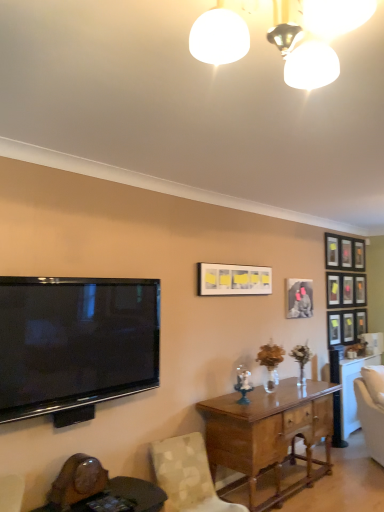
Question: Relative to white glossy light fixture at upper center, is wooden round table at lower left in front or behind?

Choices:
 (A) front
 (B) behind

Answer: (B)

Question: From the image's perspective, is wooden round table at lower left above or below white glossy light fixture at upper center?

Choices:
 (A) above
 (B) below

Answer: (B)

Question: Estimate the real-world distances between objects in this image. Which object is farther from the wooden round table at lower left?

Choices:
 (A) flat screen tv at left
 (B) matte white picture frame at center, the 1th picture frame viewed from the front
 (C) metallic silver picture frame at upper right, which is counted as the sixth picture frame, starting from the front
 (D) matte black picture frame at upper right, which is counted as the 3th picture frame, starting from the back
 (E) light brown wood desk at center

Answer: (C)

Question: Estimate the real-world distances between objects in this image. Which object is farther from the metallic silver picture frame at upper right, which ranks as the 6th picture frame in left-to-right order?

Choices:
 (A) patterned fabric chair at lower left
 (B) matte black picture frame at upper right, acting as the 5th picture frame starting from the front
 (C) wooden round table at lower left
 (D) matte black picture frame at upper right, the fourth picture frame viewed from the front
 (E) matte white picture frame at center, the 1th picture frame viewed from the front

Answer: (C)